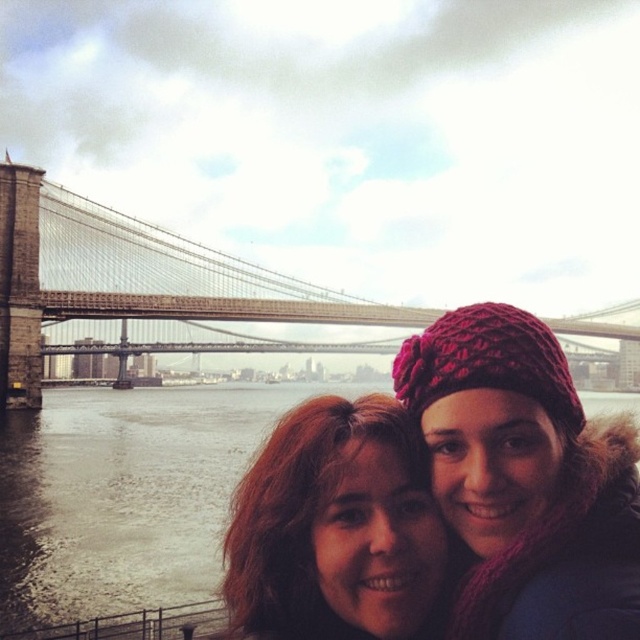
Question: Is knitted wool hat at center thinner than stone bridge at center?

Choices:
 (A) yes
 (B) no

Answer: (A)

Question: Is knitted wool hat at center below matte red knit hat at center?

Choices:
 (A) yes
 (B) no

Answer: (B)

Question: Which object is the farthest from the matte red knit hat at center?

Choices:
 (A) stone bridge at center
 (B) knitted wool hat at center

Answer: (A)

Question: Is knitted wool hat at center positioned in front of stone bridge at center?

Choices:
 (A) yes
 (B) no

Answer: (A)

Question: Which point is farther to the camera?

Choices:
 (A) matte red knit hat at center
 (B) stone bridge at center

Answer: (B)

Question: Which point is closer to the camera?

Choices:
 (A) (628, 550)
 (B) (412, 595)

Answer: (A)